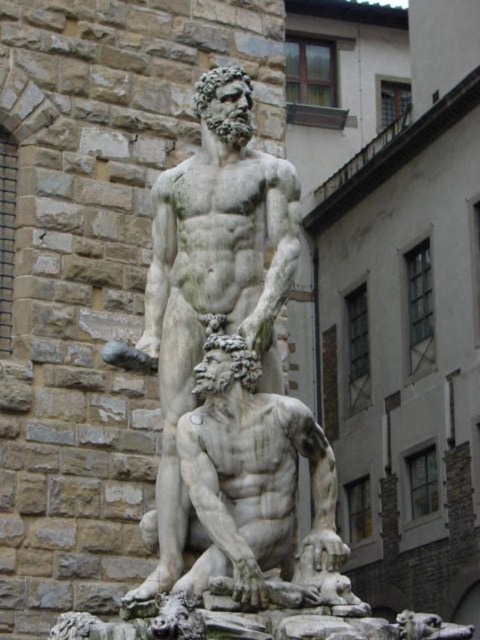
Question: Can you confirm if white marble statue at center is positioned to the right of white marble statue at lower center?

Choices:
 (A) yes
 (B) no

Answer: (B)

Question: In this image, where is white marble statue at center located relative to white marble statue at lower center?

Choices:
 (A) left
 (B) right

Answer: (A)

Question: Is white marble statue at center positioned at the back of white marble statue at lower center?

Choices:
 (A) no
 (B) yes

Answer: (B)

Question: Which point appears closest to the camera in this image?

Choices:
 (A) (236, 160)
 (B) (220, 442)

Answer: (B)

Question: Which object appears farthest from the camera in this image?

Choices:
 (A) white marble statue at center
 (B) white marble statue at lower center

Answer: (A)

Question: Which object is closer to the camera taking this photo?

Choices:
 (A) white marble statue at center
 (B) white marble statue at lower center

Answer: (B)